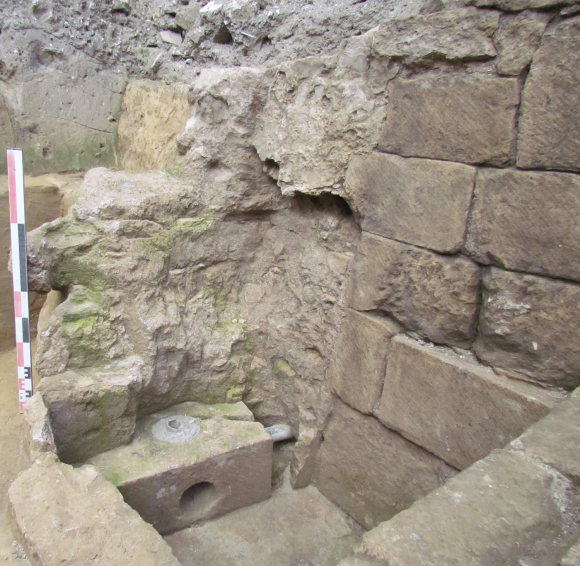
Find the location of `basin`. basin is located at coordinates (303, 556).